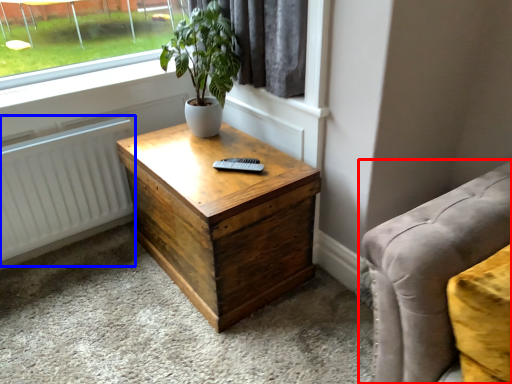
Question: Which object is further to the camera taking this photo, studio couch (highlighted by a red box) or radiator (highlighted by a blue box)?

Choices:
 (A) studio couch
 (B) radiator

Answer: (B)